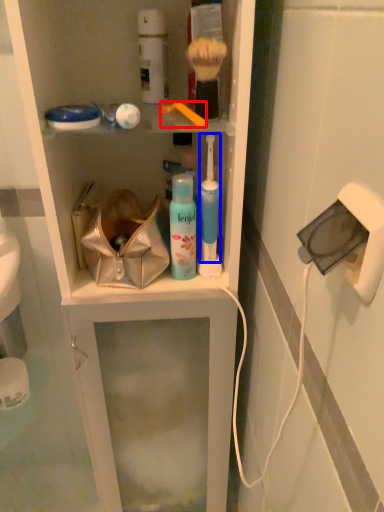
Question: Which point is further to the camera, brush (highlighted by a red box) or toiletry (highlighted by a blue box)?

Choices:
 (A) brush
 (B) toiletry

Answer: (B)